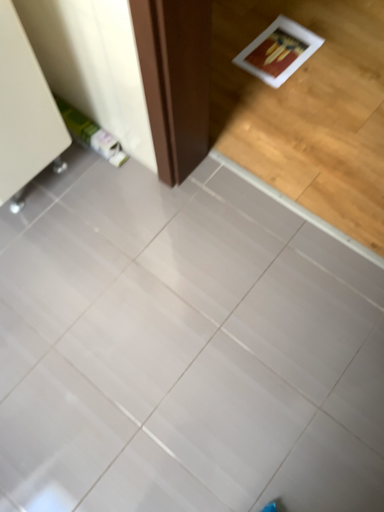
Question: Considering the positions of point (117, 367) and point (24, 48), is point (117, 367) closer or farther from the camera than point (24, 48)?

Choices:
 (A) farther
 (B) closer

Answer: (A)

Question: In terms of size, does white glossy tile at center appear bigger or smaller than white glossy cabinet at upper left?

Choices:
 (A) big
 (B) small

Answer: (A)

Question: From the image's perspective, is white glossy tile at center positioned above or below white glossy cabinet at upper left?

Choices:
 (A) below
 (B) above

Answer: (A)

Question: In terms of height, does white glossy cabinet at upper left look taller or shorter compared to white glossy tile at center?

Choices:
 (A) short
 (B) tall

Answer: (B)

Question: Relative to white glossy tile at center, is white glossy cabinet at upper left in front or behind?

Choices:
 (A) behind
 (B) front

Answer: (A)

Question: From the image's perspective, relative to white glossy tile at center, is white glossy cabinet at upper left above or below?

Choices:
 (A) below
 (B) above

Answer: (B)

Question: In terms of width, does white glossy cabinet at upper left look wider or thinner when compared to white glossy tile at center?

Choices:
 (A) thin
 (B) wide

Answer: (A)